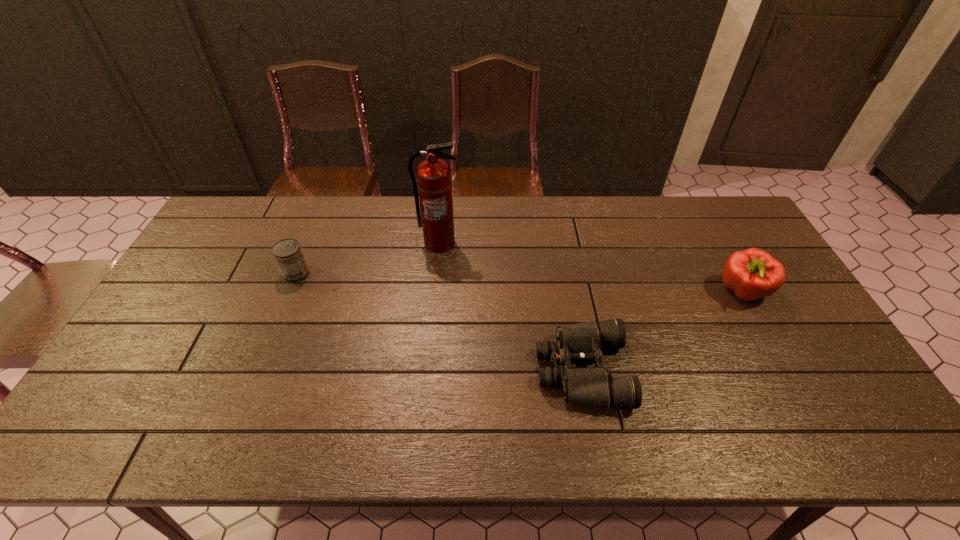
In the image, there is a desktop. Identify the location of vacant space at the far right corner. (745, 238).

Where is `empty space that is in between the farthest object and the third shortest object`? Image resolution: width=960 pixels, height=540 pixels. empty space that is in between the farthest object and the third shortest object is located at coordinates (590, 267).

Identify the location of free spot between the third shortest object and the fire extinguisher. The image size is (960, 540). (590, 267).

The height and width of the screenshot is (540, 960). I want to click on vacant space that is in between the rightmost object and the tallest object, so click(x=590, y=267).

This screenshot has height=540, width=960. I want to click on unoccupied area between the second object from left to right and the third tallest object, so click(368, 258).

The height and width of the screenshot is (540, 960). I want to click on free area in between the second tallest object and the third tallest object, so click(519, 282).

At what (x,y) coordinates should I click in order to perform the action: click on free space between the second object from left to right and the rightmost object. Please return your answer as a coordinate pair (x, y). The image size is (960, 540). Looking at the image, I should click on (590, 267).

This screenshot has width=960, height=540. Find the location of `free space between the can and the bell pepper`. free space between the can and the bell pepper is located at coordinates (519, 282).

Find the location of a particular element. free area in between the rightmost object and the leftmost object is located at coordinates (519, 282).

Locate an element on the screen. Image resolution: width=960 pixels, height=540 pixels. free point between the second object from left to right and the third shortest object is located at coordinates (590, 267).